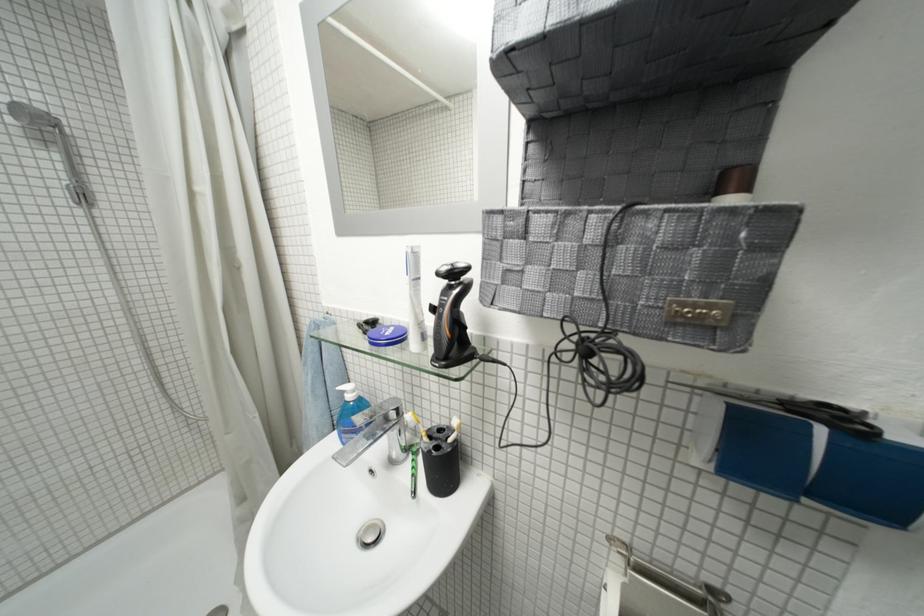
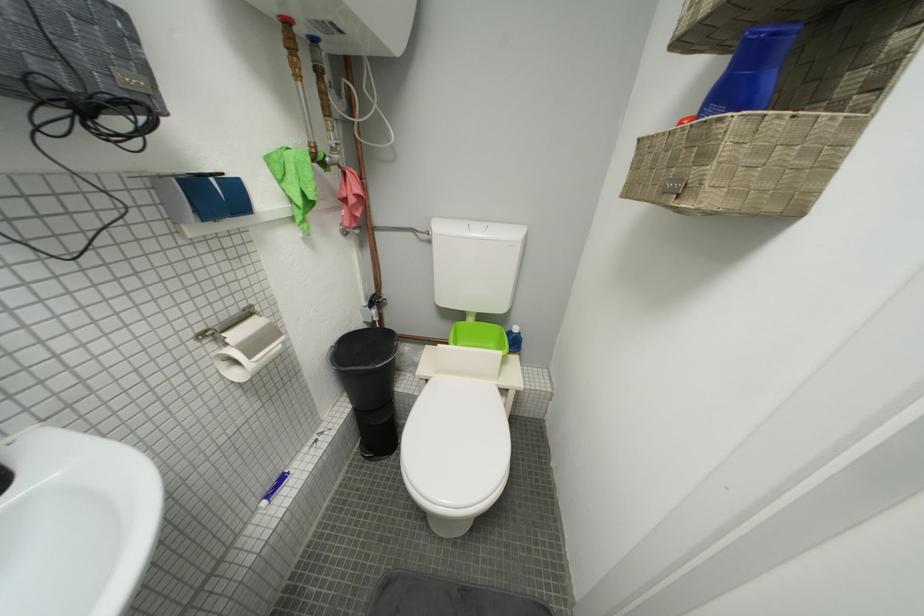
How did the camera likely rotate?

The camera rotated toward right-down.